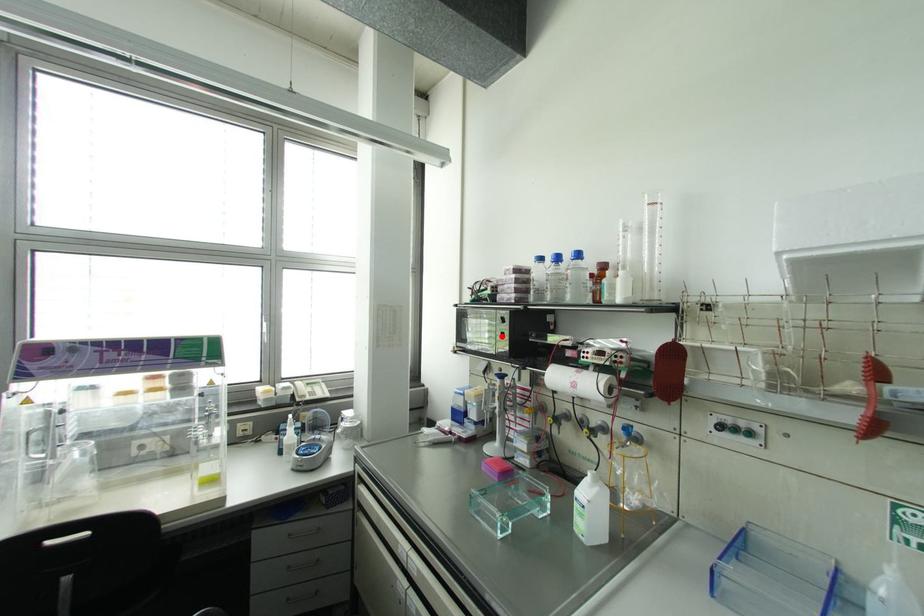
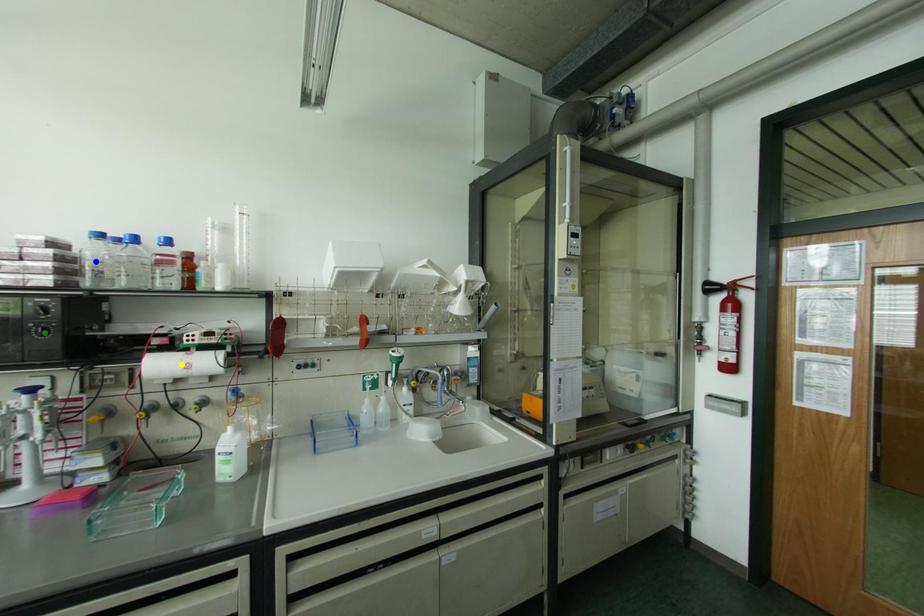
Question: I am providing you with two images of the same scene from different viewpoints. A red point is marked on the first image. You are given multiple points on the second image. Which point in image 2 is actually the same real-world point as the red point in image 1?

Choices:
 (A) green point
 (B) yellow point
 (C) blue point

Answer: (A)